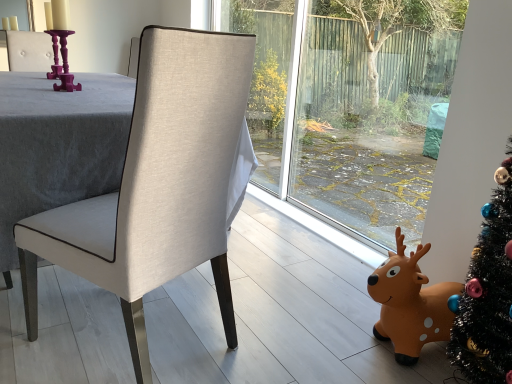
Identify the location of free space to the left of purple glossy candle holder at upper left. This screenshot has width=512, height=384. (32, 87).